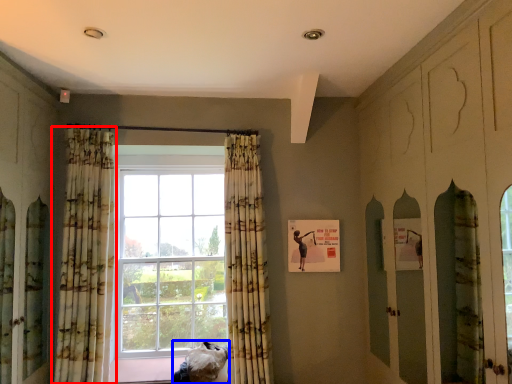
Question: Among these objects, which one is farthest to the camera, curtain (highlighted by a red box) or furniture (highlighted by a blue box)?

Choices:
 (A) curtain
 (B) furniture

Answer: (B)